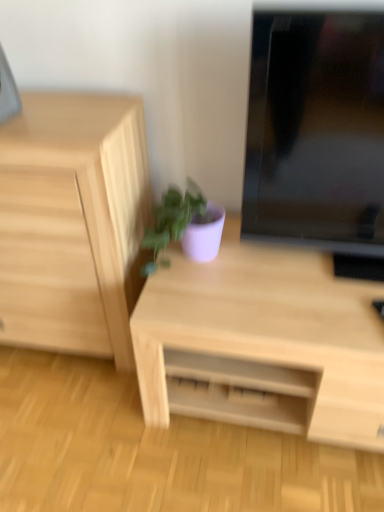
You are a GUI agent. You are given a task and a screenshot of the screen. Output one action in this format:
    pyautogui.click(x=<x>, y=<y>)
    Task: Click on the free location to the right of matte purple pot at center
    Image resolution: width=384 pixels, height=512 pixels.
    Given the screenshot: What is the action you would take?
    pyautogui.click(x=255, y=267)